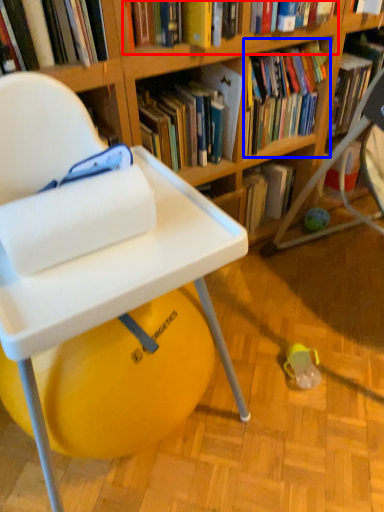
Question: Which object appears farthest to the camera in this image, book (highlighted by a red box) or book (highlighted by a blue box)?

Choices:
 (A) book
 (B) book

Answer: (B)